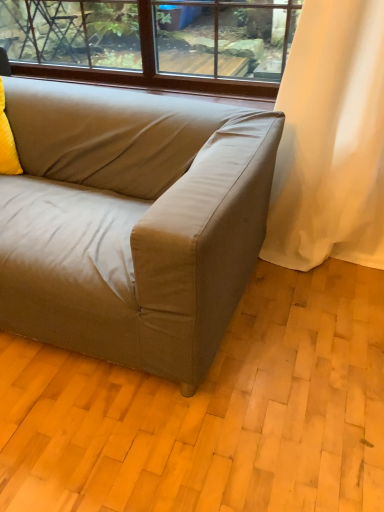
Identify the location of suede-like beige couch at center. (131, 222).

Describe the element at coordinates (131, 222) in the screenshot. I see `suede-like beige couch at center` at that location.

The image size is (384, 512). What do you see at coordinates (7, 142) in the screenshot?
I see `yellow fabric pillow at left` at bounding box center [7, 142].

This screenshot has height=512, width=384. I want to click on yellow fabric pillow at left, so click(7, 142).

Measure the distance between yellow fabric pillow at left and camera.

The distance of yellow fabric pillow at left from camera is 5.55 feet.

Identify the location of suede-like beige couch at center. Image resolution: width=384 pixels, height=512 pixels. pos(131,222).

Is yellow fabric pillow at left at the right side of suede-like beige couch at center?

No.

Does yellow fabric pillow at left lie behind suede-like beige couch at center?

Yes, yellow fabric pillow at left is further from the camera.

Which is in front, point (5, 128) or point (56, 321)?

Positioned in front is point (56, 321).

From the image's perspective, is yellow fabric pillow at left located above or below suede-like beige couch at center?

yellow fabric pillow at left is above suede-like beige couch at center.

From a real-world perspective, who is located lower, yellow fabric pillow at left or suede-like beige couch at center?

In real-world perspective, suede-like beige couch at center is lower.

In the scene shown: Which object is thinner, yellow fabric pillow at left or suede-like beige couch at center?

yellow fabric pillow at left.

Considering the sizes of objects yellow fabric pillow at left and suede-like beige couch at center in the image provided, who is taller, yellow fabric pillow at left or suede-like beige couch at center?

suede-like beige couch at center.

Considering the relative sizes of yellow fabric pillow at left and suede-like beige couch at center in the image provided, is yellow fabric pillow at left smaller than suede-like beige couch at center?

Indeed, yellow fabric pillow at left has a smaller size compared to suede-like beige couch at center.

Is suede-like beige couch at center located within yellow fabric pillow at left?

No, suede-like beige couch at center is not surrounded by yellow fabric pillow at left.

Is yellow fabric pillow at left positioned far away from suede-like beige couch at center?

They are positioned close to each other.

Looking at this image, is yellow fabric pillow at left aimed at suede-like beige couch at center?

Yes, yellow fabric pillow at left is facing suede-like beige couch at center.

Locate an element on the screen. The image size is (384, 512). studio couch on the right side of yellow fabric pillow at left is located at coordinates (131, 222).

Which is more to the right, suede-like beige couch at center or yellow fabric pillow at left?

suede-like beige couch at center.

Considering their positions, is suede-like beige couch at center located in front of or behind yellow fabric pillow at left?

Clearly, suede-like beige couch at center is in front of yellow fabric pillow at left.

Which point is more forward, (120, 125) or (7, 152)?

Point (120, 125)

From the image's perspective, is suede-like beige couch at center on yellow fabric pillow at left?

No.

From a real-world perspective, is suede-like beige couch at center beneath yellow fabric pillow at left?

Indeed, from a real-world perspective, suede-like beige couch at center is positioned beneath yellow fabric pillow at left.

In terms of width, does suede-like beige couch at center look wider or thinner when compared to yellow fabric pillow at left?

suede-like beige couch at center is wider than yellow fabric pillow at left.

Who is shorter, suede-like beige couch at center or yellow fabric pillow at left?

yellow fabric pillow at left.

Based on their sizes in the image, would you say suede-like beige couch at center is bigger or smaller than yellow fabric pillow at left?

In the image, suede-like beige couch at center appears to be larger than yellow fabric pillow at left.

Looking at this image, is yellow fabric pillow at left surrounded by suede-like beige couch at center?

Yes, yellow fabric pillow at left is a part of suede-like beige couch at center.

Is suede-like beige couch at center not near yellow fabric pillow at left?

No, suede-like beige couch at center is in close proximity to yellow fabric pillow at left.

Is suede-like beige couch at center facing towards yellow fabric pillow at left?

Yes, suede-like beige couch at center is facing yellow fabric pillow at left.

Can you tell me how much suede-like beige couch at center and yellow fabric pillow at left differ in facing direction?

The facing directions of suede-like beige couch at center and yellow fabric pillow at left are 27.3 degrees apart.

How much distance is there between suede-like beige couch at center and yellow fabric pillow at left?

suede-like beige couch at center and yellow fabric pillow at left are 23.80 inches apart from each other.

Where is `studio couch in front of the yellow fabric pillow at left`? The image size is (384, 512). studio couch in front of the yellow fabric pillow at left is located at coordinates (131, 222).

Find the location of a particular element. This screenshot has height=512, width=384. studio couch in front of the yellow fabric pillow at left is located at coordinates (131, 222).

The image size is (384, 512). In the image, there is a yellow fabric pillow at left. In order to click on studio couch below it (from a real-world perspective) in this screenshot , I will do `click(131, 222)`.